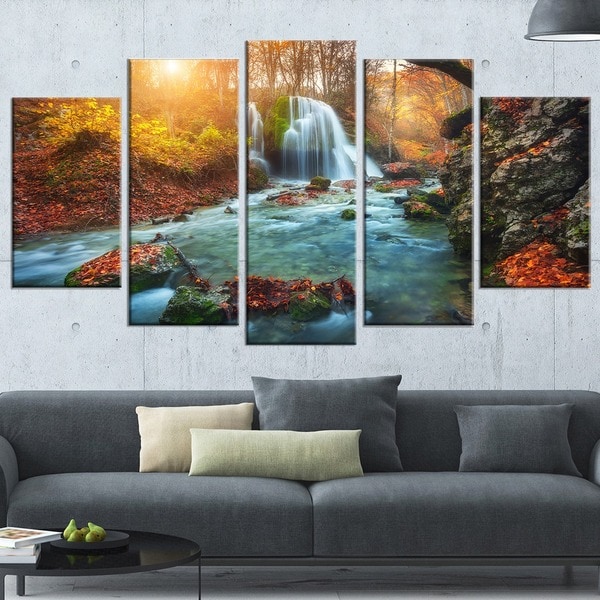
Where is `table`? The image size is (600, 600). table is located at coordinates coord(169,550).